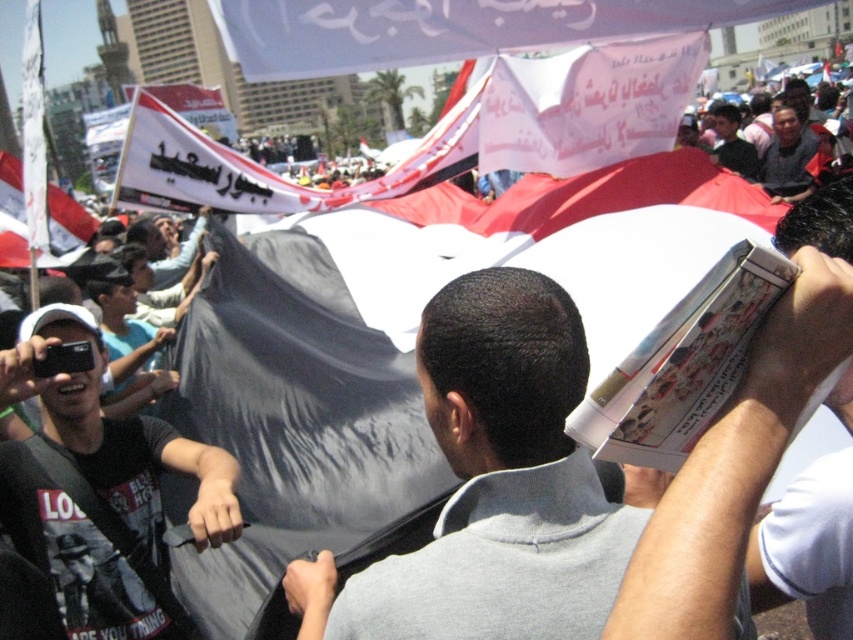
You are a photographer at the event and need to capture a clear shot of the gray matte book at center and the dark gray fabric at upper center. Which object should you zoom in on to ensure it takes up more space in your photo?

The dark gray fabric at upper center is larger than the gray matte book at center, so zooming in on the dark gray fabric at upper center will make it take up more space in the photo.